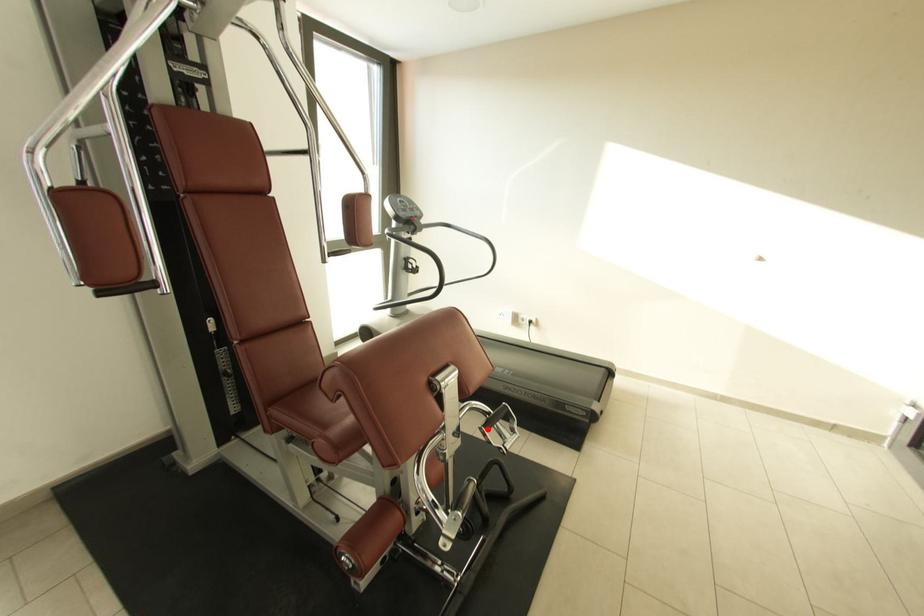
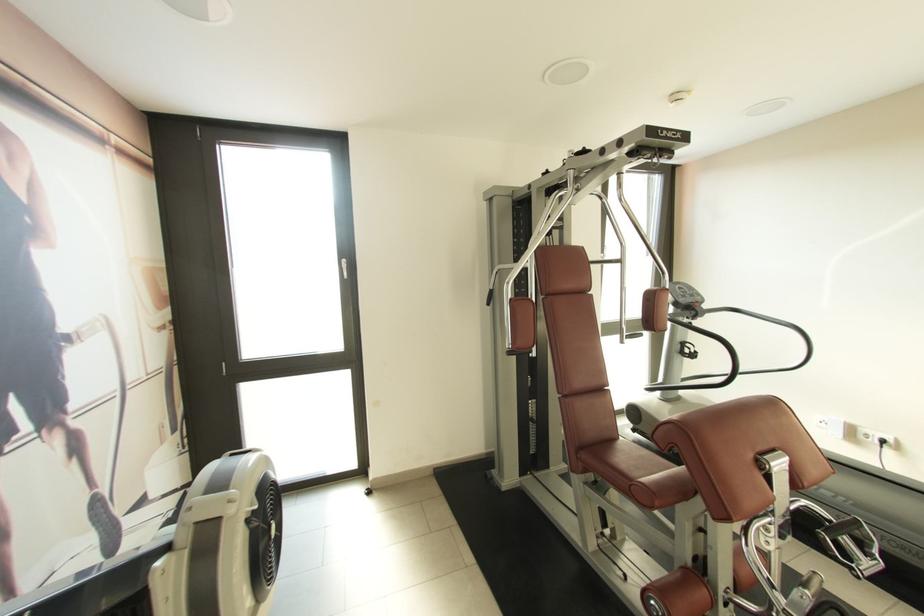
Question: I am providing you with two images of the same scene from different viewpoints. A red point is shown in image1. For the corresponding object point in image2, is it positioned nearer or farther from the camera?

Choices:
 (A) Nearer
 (B) Farther

Answer: (A)